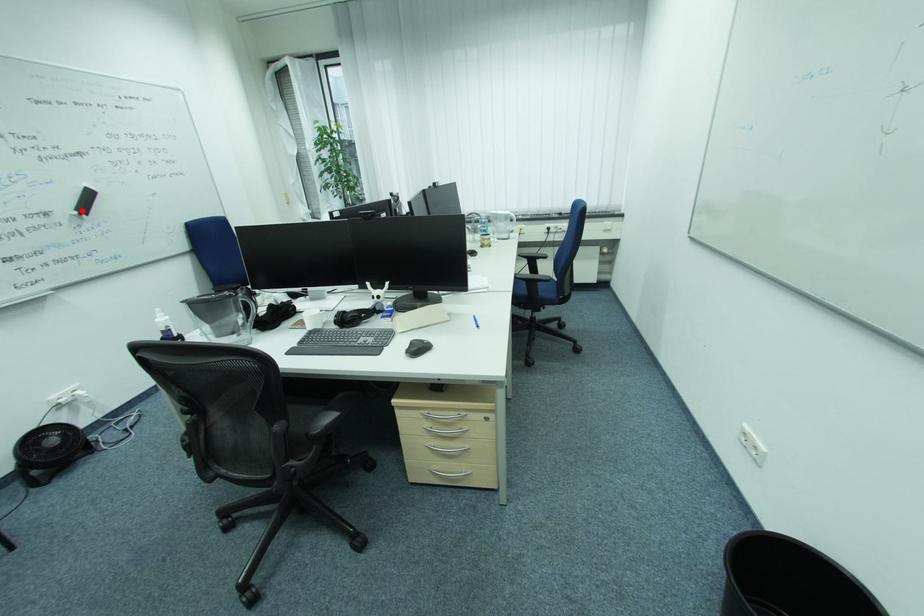
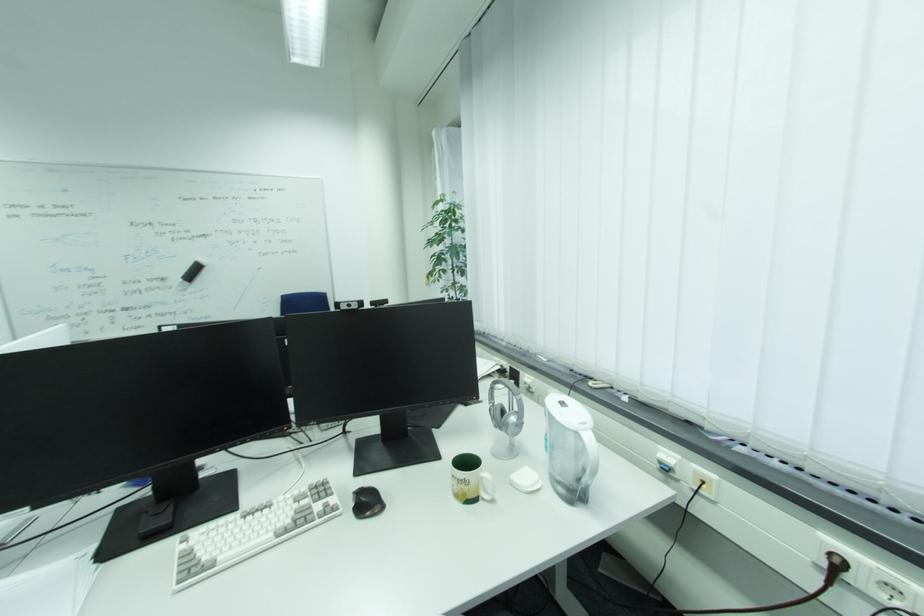
Locate, in the second image, the point that corresponds to the highlighted location in the first image.

(189, 278)